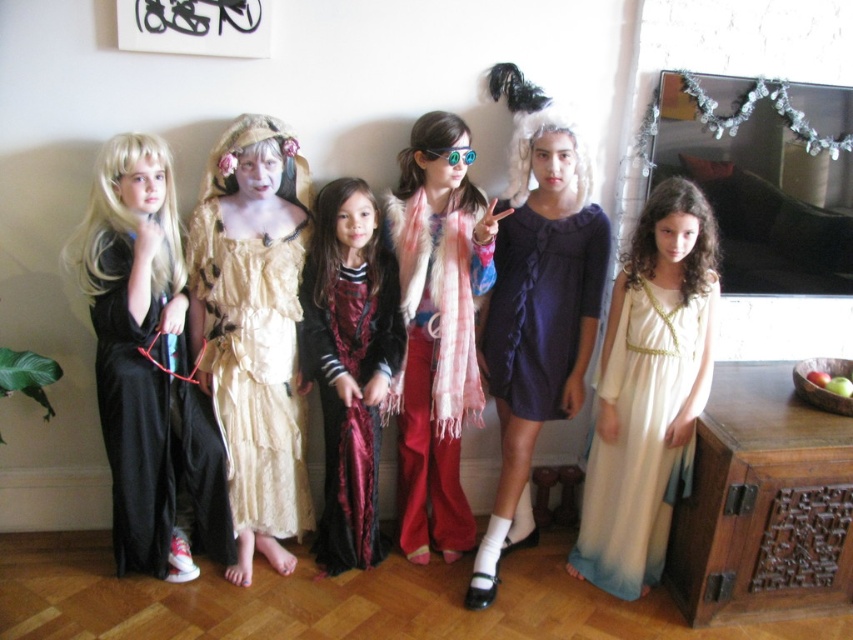
Question: Considering the relative positions of matte purple dress at center and translucent plastic goggles at center in the image provided, where is matte purple dress at center located with respect to translucent plastic goggles at center?

Choices:
 (A) right
 (B) left

Answer: (A)

Question: Which object is the farthest from the white silk dress at center?

Choices:
 (A) plaid scarf at center
 (B) matte purple dress at center
 (C) light beige lace dress at center
 (D) dark purple knit dress at center

Answer: (C)

Question: Is matte black dress at left thinner than light beige lace dress at center?

Choices:
 (A) yes
 (B) no

Answer: (B)

Question: Which object is farther from the camera taking this photo?

Choices:
 (A) plaid scarf at center
 (B) translucent plastic goggles at center

Answer: (B)

Question: Can you confirm if white silk dress at center is positioned to the right of plaid scarf at center?

Choices:
 (A) no
 (B) yes

Answer: (B)

Question: Which point is farther to the camera?

Choices:
 (A) velvet maroon dress at center
 (B) plaid scarf at center

Answer: (A)